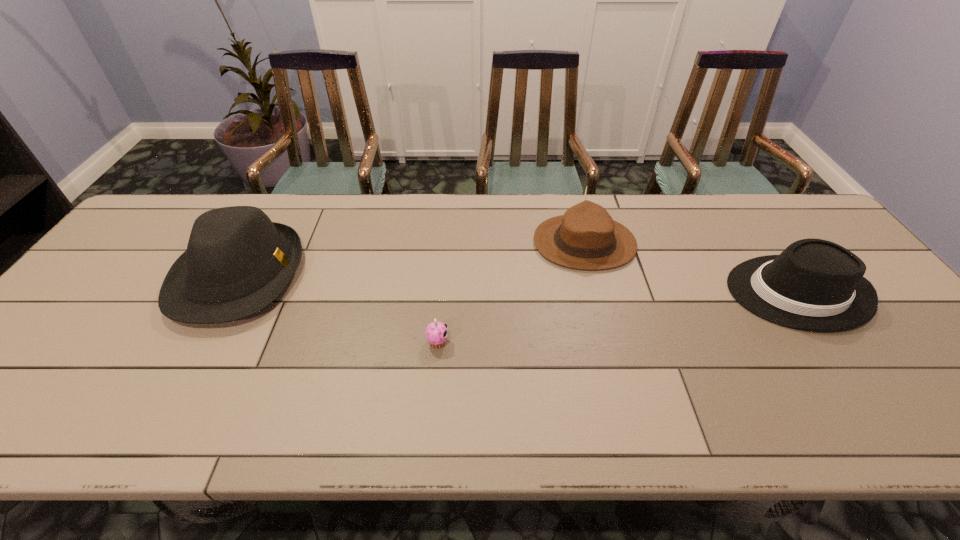
The height and width of the screenshot is (540, 960). In order to click on free space located 0.170m on the front-facing side of the rightmost fedora in this screenshot , I will do `click(664, 293)`.

You are a GUI agent. You are given a task and a screenshot of the screen. Output one action in this format:
    pyautogui.click(x=<x>, y=<y>)
    Task: Click on the vacant region located on the front-facing side of the rightmost fedora
    The height and width of the screenshot is (540, 960).
    Given the screenshot: What is the action you would take?
    pyautogui.click(x=676, y=293)

Image resolution: width=960 pixels, height=540 pixels. Find the location of `vacant space located 0.120m on the front-facing side of the rightmost fedora`. vacant space located 0.120m on the front-facing side of the rightmost fedora is located at coordinates (684, 293).

Find the location of a particular element. Image resolution: width=960 pixels, height=540 pixels. vacant space located on the face of the shortest object is located at coordinates (508, 342).

The width and height of the screenshot is (960, 540). In order to click on object that is at the right edge in this screenshot , I will do `click(816, 285)`.

The width and height of the screenshot is (960, 540). I want to click on vacant space at the far edge of the desktop, so click(348, 233).

Locate an element on the screen. vacant space at the near edge of the desktop is located at coordinates (319, 410).

You are a GUI agent. You are given a task and a screenshot of the screen. Output one action in this format:
    pyautogui.click(x=<x>, y=<y>)
    Task: Click on the free space at the right edge
    The width and height of the screenshot is (960, 540).
    Given the screenshot: What is the action you would take?
    pyautogui.click(x=870, y=332)

Locate an element on the screen. vacant space at the far left corner of the desktop is located at coordinates (175, 230).

The width and height of the screenshot is (960, 540). Identify the location of free space at the near left corner. (9, 427).